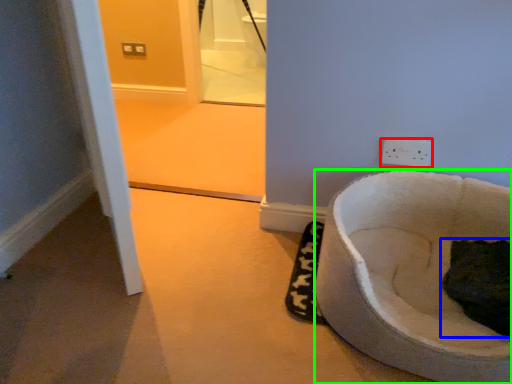
Question: Based on their relative distances, which object is nearer to power plugs and sockets (highlighted by a red box)? Choose from cat (highlighted by a blue box) and toilet (highlighted by a green box).

Choices:
 (A) cat
 (B) toilet

Answer: (B)